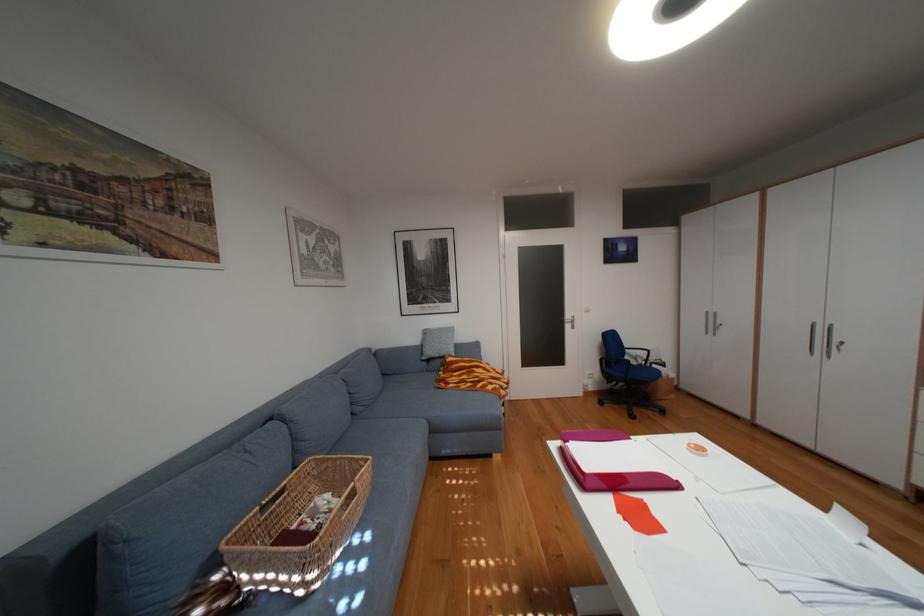
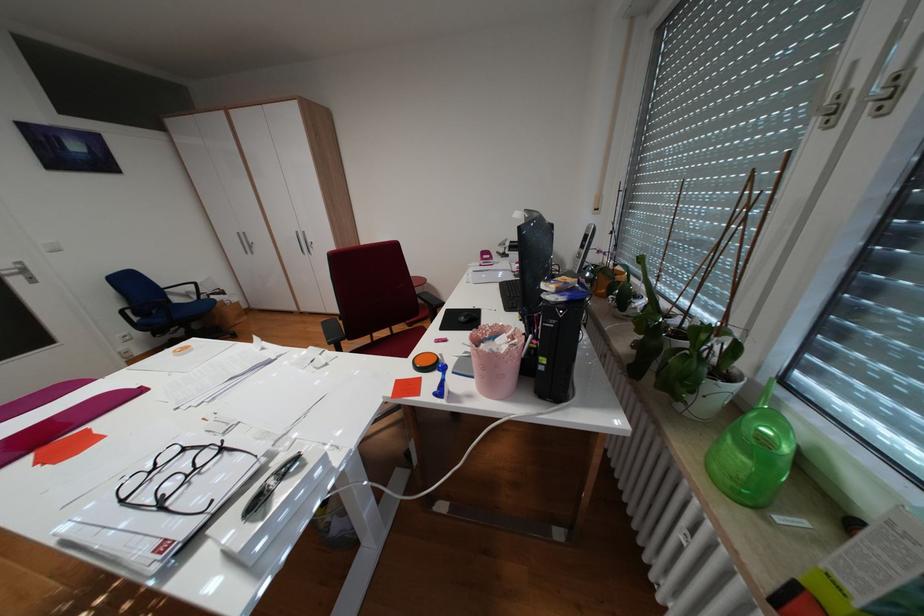
From the picture: The first image is from the beginning of the video and the second image is from the end. How did the camera likely rotate when shooting the video?

The rotation direction of the camera is right-down.